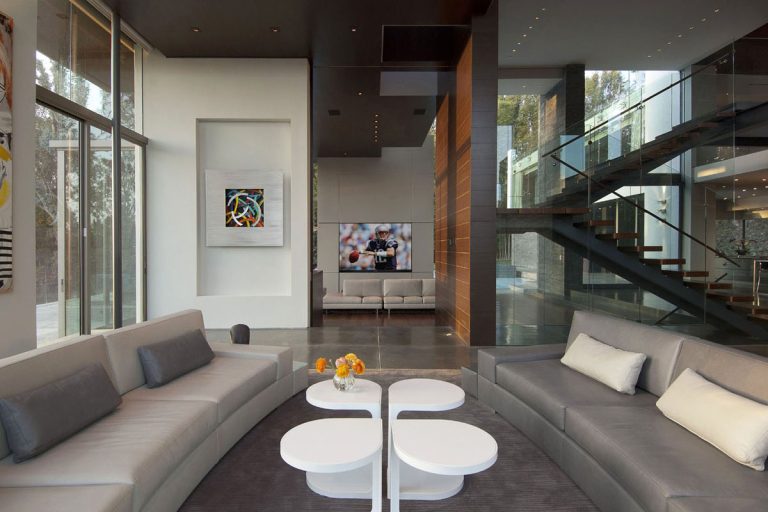
Locate an element on the screen. The height and width of the screenshot is (512, 768). table is located at coordinates (373, 430), (415, 436), (421, 389), (369, 397).